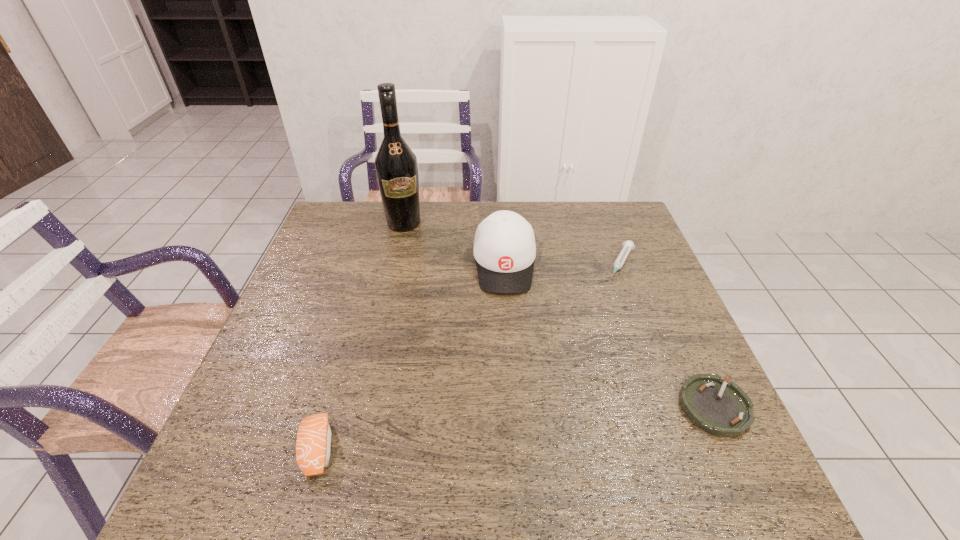
Locate an element on the screen. This screenshot has width=960, height=540. sushi is located at coordinates (313, 443).

Image resolution: width=960 pixels, height=540 pixels. I want to click on ashtray, so click(722, 409).

Where is `syringe`? syringe is located at coordinates (628, 245).

Identify the location of baseball cap. The image size is (960, 540). (504, 248).

Identify the location of the second tallest object. (504, 248).

In order to click on wine bottle in this screenshot , I will do `click(396, 167)`.

Find the location of a particular element. This screenshot has width=960, height=540. the tallest object is located at coordinates (396, 167).

The image size is (960, 540). What are the coordinates of `vacant space located on the back of the third shortest object` in the screenshot? It's located at (347, 348).

Find the location of `free space located 0.370m on the back of the ashtray`. free space located 0.370m on the back of the ashtray is located at coordinates (653, 273).

This screenshot has width=960, height=540. I want to click on vacant space positioned at the needle end of the syringe, so click(x=576, y=361).